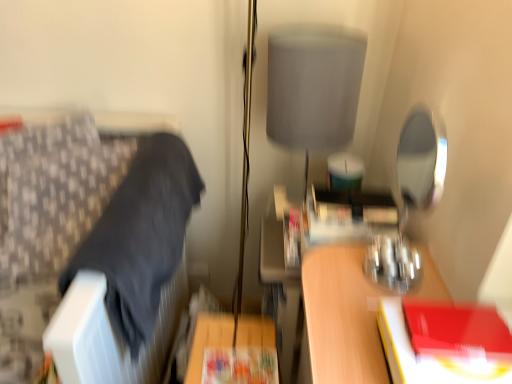
You are a GUI agent. You are given a task and a screenshot of the screen. Output one action in this format:
    pyautogui.click(x=<x>, y=<y>)
    Task: Click on the gray fabric lampshade at upper center
    
    Given the screenshot: What is the action you would take?
    pyautogui.click(x=314, y=87)

The height and width of the screenshot is (384, 512). Identify the location of gray fabric lampshade at upper center. (314, 87).

From the picture: Would you say red matte book at right, which is the 2th paperback book in back-to-front order, is a long distance from matte paper paperback book at center, the 1th paperback book viewed from the back?

Actually, red matte book at right, which is the 2th paperback book in back-to-front order, and matte paper paperback book at center, the 1th paperback book viewed from the back, are a little close together.

Is red matte book at right, which is the second paperback book in bottom-to-top order, situated inside matte paper paperback book at center, the 1th paperback book viewed from the back, or outside?

red matte book at right, which is the second paperback book in bottom-to-top order, exists outside the volume of matte paper paperback book at center, the 1th paperback book viewed from the back.

From a real-world perspective, relative to matte paper paperback book at center, the 1th paperback book viewed from the back, is red matte book at right, which is counted as the first paperback book, starting from the right, vertically above or below?

From a real-world perspective, red matte book at right, which is counted as the first paperback book, starting from the right, is physically above matte paper paperback book at center, the 1th paperback book viewed from the back.

From the image's perspective, is red matte book at right, which is counted as the first paperback book, starting from the right, located above or below matte paper paperback book at center, which is the first paperback book in bottom-to-top order?

Clearly, from the image's perspective, red matte book at right, which is counted as the first paperback book, starting from the right, is above matte paper paperback book at center, which is the first paperback book in bottom-to-top order.

Does patterned fabric cushion at left touch red matte book at right, the 1th paperback book from the top?

No.

Considering the relative sizes of patterned fabric cushion at left and red matte book at right, which is the second paperback book in bottom-to-top order, in the image provided, is patterned fabric cushion at left bigger than red matte book at right, which is the second paperback book in bottom-to-top order,?

Indeed, patterned fabric cushion at left has a larger size compared to red matte book at right, which is the second paperback book in bottom-to-top order.

Who is taller, patterned fabric cushion at left or red matte book at right, which is the second paperback book in bottom-to-top order?

With more height is patterned fabric cushion at left.

Is patterned fabric cushion at left wider or thinner than red matte book at right, which is the 2th paperback book in back-to-front order?

In the image, patterned fabric cushion at left appears to be wider than red matte book at right, which is the 2th paperback book in back-to-front order.

Between point (218, 357) and point (272, 57), which one is positioned behind?

Positioned behind is point (272, 57).

From a real-world perspective, which object stands above the other?

gray fabric lampshade at upper center is physically above.

Is matte paper paperback book at center, the 1th paperback book viewed from the back, positioned before gray fabric lampshade at upper center?

Yes, it is.

Is red matte book at right, the 2th paperback book viewed from the left, inside or outside of patterned fabric cushion at left?

The correct answer is: outside.

Looking at their sizes, would you say red matte book at right, which is counted as the first paperback book, starting from the right, is wider or thinner than patterned fabric cushion at left?

Considering their sizes, red matte book at right, which is counted as the first paperback book, starting from the right, looks slimmer than patterned fabric cushion at left.

Considering the positions of objects red matte book at right, the 2th paperback book viewed from the left, and patterned fabric cushion at left in the image provided, who is more to the right, red matte book at right, the 2th paperback book viewed from the left, or patterned fabric cushion at left?

Positioned to the right is red matte book at right, the 2th paperback book viewed from the left.

Between red matte book at right, which is the second paperback book in bottom-to-top order, and gray fabric lampshade at upper center, which one is positioned in front?

red matte book at right, which is the second paperback book in bottom-to-top order, is closer to the camera.

Is red matte book at right, which is the second paperback book in bottom-to-top order, aimed at gray fabric lampshade at upper center?

No, red matte book at right, which is the second paperback book in bottom-to-top order, is not turned towards gray fabric lampshade at upper center.

Which is more to the right, red matte book at right, the 2th paperback book viewed from the left, or gray fabric lampshade at upper center?

red matte book at right, the 2th paperback book viewed from the left.

In terms of size, does red matte book at right, the 1th paperback book from the top, appear bigger or smaller than gray fabric lampshade at upper center?

In the image, red matte book at right, the 1th paperback book from the top, appears to be smaller than gray fabric lampshade at upper center.

Locate an element on the screen. Image resolution: width=512 pixels, height=384 pixels. paperback book located on the right of matte paper paperback book at center, the 2th paperback book positioned from the right is located at coordinates (429, 356).

Which object is positioned more to the left, matte paper paperback book at center, which is the second paperback book in top-to-bottom order, or red matte book at right, the 1th paperback book from the top?

matte paper paperback book at center, which is the second paperback book in top-to-bottom order.

Which of these two, matte paper paperback book at center, the 1th paperback book viewed from the back, or red matte book at right, which is the 2th paperback book in back-to-front order, is smaller?

With smaller size is matte paper paperback book at center, the 1th paperback book viewed from the back.

How different are the orientations of gray fabric lampshade at upper center and red matte book at right, the 1th paperback book in the front-to-back sequence, in degrees?

0.000132 degrees separate the facing orientations of gray fabric lampshade at upper center and red matte book at right, the 1th paperback book in the front-to-back sequence.

I want to click on paperback book to the right of gray fabric lampshade at upper center, so click(x=429, y=356).

Is gray fabric lampshade at upper center further to camera compared to red matte book at right, the 1th paperback book in the front-to-back sequence?

That is True.

From the image's perspective, which is above, gray fabric lampshade at upper center or red matte book at right, which is counted as the first paperback book, starting from the right?

From the image's view, gray fabric lampshade at upper center is above.

This screenshot has height=384, width=512. What are the coordinates of `paperback book on the right of matte paper paperback book at center, which is the second paperback book in top-to-bottom order` in the screenshot? It's located at (429, 356).

Image resolution: width=512 pixels, height=384 pixels. What are the coordinates of `furniture below the red matte book at right, the 2th paperback book viewed from the left (from a real-world perspective)` in the screenshot? It's located at (53, 211).

Considering their positions, is red matte book at right, which is the 2th paperback book in back-to-front order, positioned closer to gray fabric lampshade at upper center than matte paper paperback book at center, positioned as the first paperback book in left-to-right order?

red matte book at right, which is the 2th paperback book in back-to-front order, lies closer to gray fabric lampshade at upper center than the other object.

Looking at the image, which one is located closer to red matte book at right, which is the 2th paperback book in back-to-front order, patterned fabric cushion at left or gray fabric lampshade at upper center?

Among the two, gray fabric lampshade at upper center is located nearer to red matte book at right, which is the 2th paperback book in back-to-front order.

Estimate the real-world distances between objects in this image. Which object is closer to matte paper paperback book at center, the 1th paperback book viewed from the back, red matte book at right, the 1th paperback book from the top, or gray fabric lampshade at upper center?

red matte book at right, the 1th paperback book from the top, is positioned closer to the anchor matte paper paperback book at center, the 1th paperback book viewed from the back.

When comparing their distances from gray fabric lampshade at upper center, does matte paper paperback book at center, the 1th paperback book viewed from the back, or red matte book at right, which is the second paperback book in bottom-to-top order, seem closer?

Among the two, red matte book at right, which is the second paperback book in bottom-to-top order, is located nearer to gray fabric lampshade at upper center.

When comparing their distances from matte paper paperback book at center, which is the first paperback book in bottom-to-top order, does patterned fabric cushion at left or gray fabric lampshade at upper center seem further?

gray fabric lampshade at upper center.

Estimate the real-world distances between objects in this image. Which object is closer to red matte book at right, which is the 2th paperback book in back-to-front order, gray fabric lampshade at upper center or matte paper paperback book at center, which is the first paperback book in bottom-to-top order?

matte paper paperback book at center, which is the first paperback book in bottom-to-top order, is closer to red matte book at right, which is the 2th paperback book in back-to-front order.

Which object lies nearer to the anchor point gray fabric lampshade at upper center, red matte book at right, which is counted as the first paperback book, starting from the right, or patterned fabric cushion at left?

Based on the image, patterned fabric cushion at left appears to be nearer to gray fabric lampshade at upper center.

Based on the photo, considering their positions, is gray fabric lampshade at upper center positioned further to red matte book at right, which is counted as the first paperback book, starting from the right, than patterned fabric cushion at left?

patterned fabric cushion at left lies further to red matte book at right, which is counted as the first paperback book, starting from the right, than the other object.

Where is `paperback book between gray fabric lampshade at upper center and matte paper paperback book at center, which is the first paperback book in bottom-to-top order, from top to bottom`? paperback book between gray fabric lampshade at upper center and matte paper paperback book at center, which is the first paperback book in bottom-to-top order, from top to bottom is located at coordinates click(429, 356).

This screenshot has width=512, height=384. I want to click on table lamp situated between patterned fabric cushion at left and red matte book at right, which is the second paperback book in bottom-to-top order, from left to right, so click(314, 87).

This screenshot has height=384, width=512. I want to click on paperback book situated between patterned fabric cushion at left and gray fabric lampshade at upper center from left to right, so pyautogui.click(x=240, y=366).

I want to click on paperback book between patterned fabric cushion at left and red matte book at right, the 1th paperback book from the top, in the horizontal direction, so click(x=240, y=366).